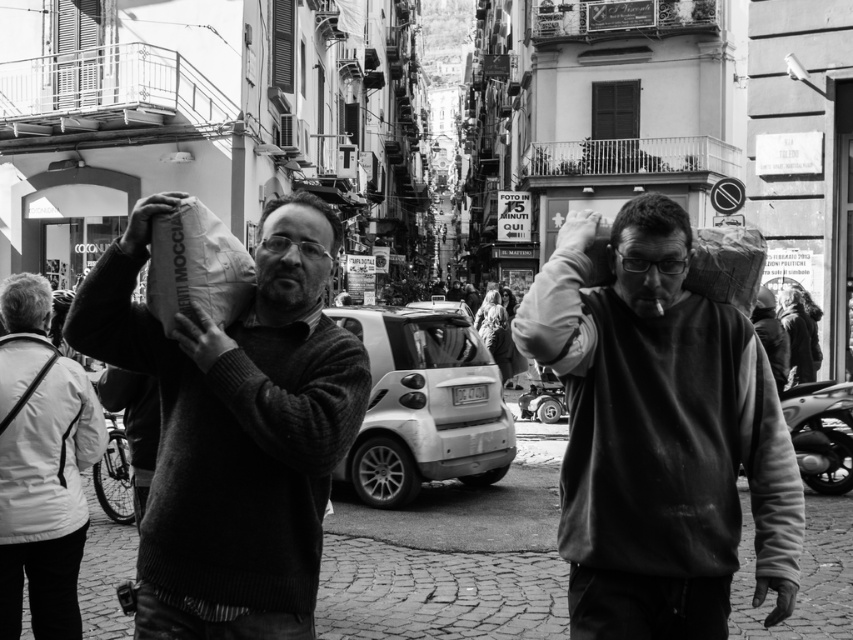
Between white fabric bag at left and matte black head at center, which one appears on the left side from the viewer's perspective?

From the viewer's perspective, white fabric bag at left appears more on the left side.

Between white fabric bag at left and matte black head at center, which one has more height?

white fabric bag at left

This screenshot has width=853, height=640. I want to click on white fabric bag at left, so click(x=41, y=467).

What are the coordinates of `white fabric bag at left` in the screenshot? It's located at (41, 467).

Which of these two, smooth skin head at center or smooth gray hair at upper left, stands taller?

smooth skin head at center

Looking at this image, which is below, smooth skin head at center or smooth gray hair at upper left?

smooth gray hair at upper left is below.

Which is in front, point (293, 289) or point (9, 284)?

Point (293, 289)

In order to click on smooth skin head at center in this screenshot , I will do `click(292, 253)`.

Between matte gray sweater at center and white fabric bag at left, which one is positioned higher?

Positioned higher is matte gray sweater at center.

Is point (662, 627) positioned behind point (67, 371)?

No.

Where is `matte gray sweater at center`? This screenshot has width=853, height=640. matte gray sweater at center is located at coordinates (659, 435).